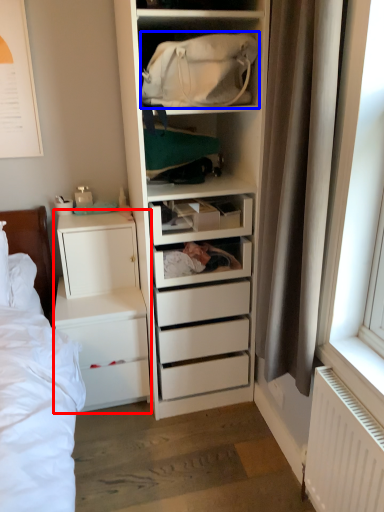
Question: Which of the following is the farthest to the observer, chest of drawers (highlighted by a red box) or bag (highlighted by a blue box)?

Choices:
 (A) chest of drawers
 (B) bag

Answer: (A)